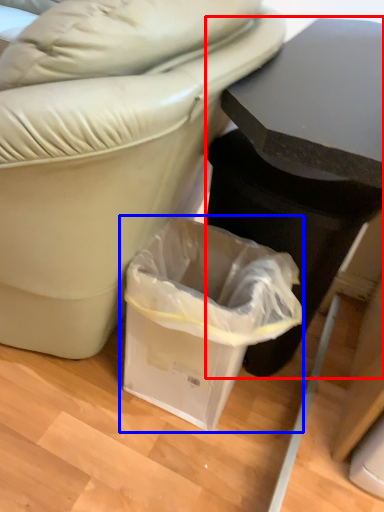
Question: Which object is further to the camera taking this photo, table (highlighted by a red box) or waste container (highlighted by a blue box)?

Choices:
 (A) table
 (B) waste container

Answer: (B)